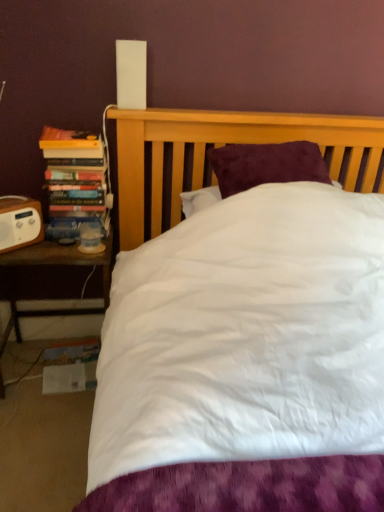
Question: Is hardcover books at left thinner than brown wooden nightstand at left?

Choices:
 (A) yes
 (B) no

Answer: (A)

Question: From the image's perspective, does hardcover books at left appear higher than brown wooden nightstand at left?

Choices:
 (A) no
 (B) yes

Answer: (B)

Question: Is brown wooden nightstand at left at the back of hardcover books at left?

Choices:
 (A) no
 (B) yes

Answer: (A)

Question: Can you confirm if hardcover books at left is taller than brown wooden nightstand at left?

Choices:
 (A) no
 (B) yes

Answer: (A)

Question: From the image's perspective, is hardcover books at left below brown wooden nightstand at left?

Choices:
 (A) no
 (B) yes

Answer: (A)

Question: Can you confirm if hardcover books at left is positioned to the right of brown wooden nightstand at left?

Choices:
 (A) yes
 (B) no

Answer: (A)

Question: Does brown wooden nightstand at left appear on the left side of white plastic speaker at left?

Choices:
 (A) yes
 (B) no

Answer: (B)

Question: Considering the relative sizes of brown wooden nightstand at left and white plastic speaker at left in the image provided, is brown wooden nightstand at left wider than white plastic speaker at left?

Choices:
 (A) no
 (B) yes

Answer: (B)

Question: Would you say brown wooden nightstand at left is outside white plastic speaker at left?

Choices:
 (A) no
 (B) yes

Answer: (B)

Question: Is brown wooden nightstand at left taller than white plastic speaker at left?

Choices:
 (A) no
 (B) yes

Answer: (B)

Question: Is the position of brown wooden nightstand at left less distant than that of white plastic speaker at left?

Choices:
 (A) no
 (B) yes

Answer: (A)

Question: Is brown wooden nightstand at left placed right next to white plastic speaker at left?

Choices:
 (A) yes
 (B) no

Answer: (B)

Question: From the image's perspective, does brown wooden nightstand at left appear higher than hardcover books at left?

Choices:
 (A) yes
 (B) no

Answer: (B)